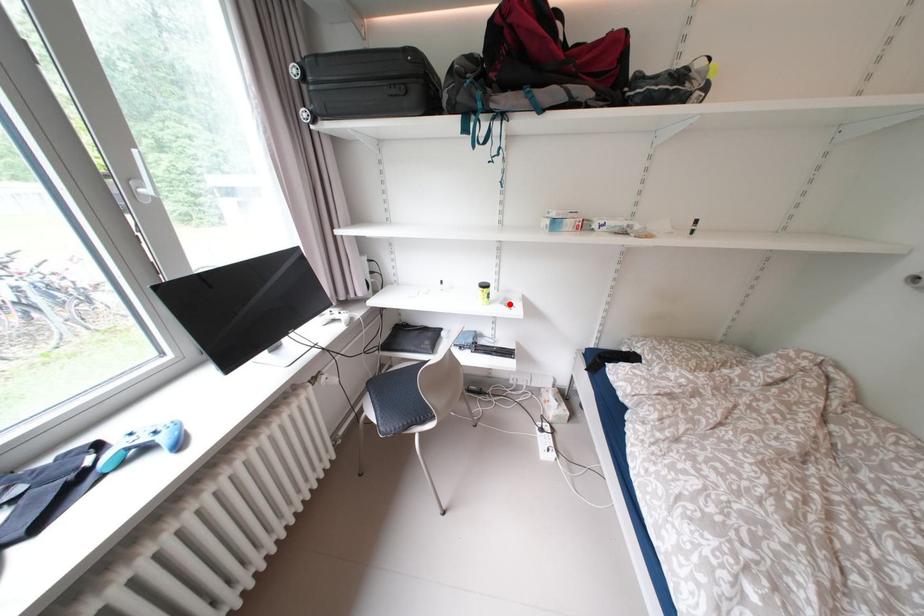
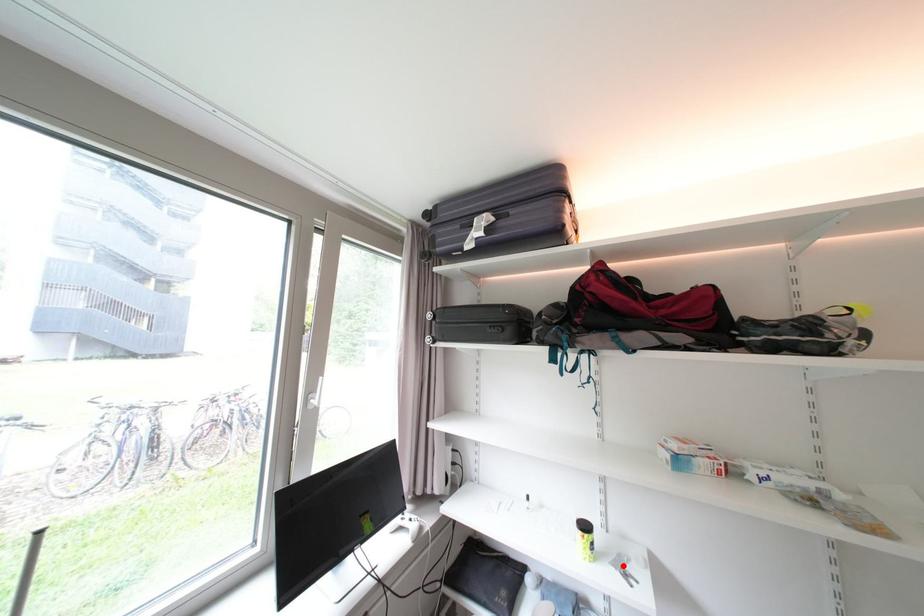
I am providing you with two images of the same scene from different viewpoints. A red point is marked on the first image and another point is marked on the second image. Are the points marked in image1 and image2 representing the same 3D position?

Yes